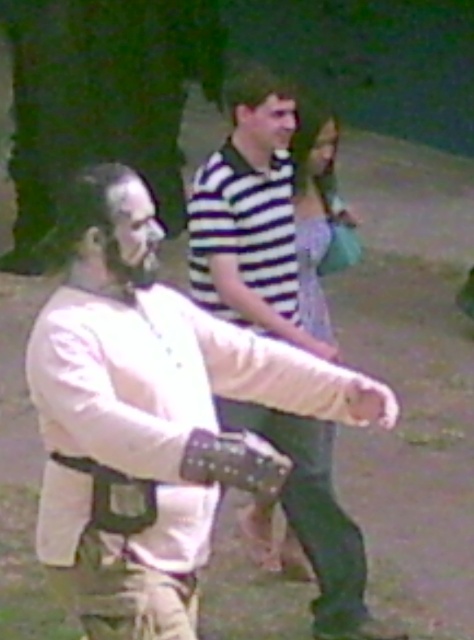
Does point (196, 531) come closer to viewer compared to point (329, 152)?

That is True.

Is white leather armor at center shorter than matte striped shirt at upper center?

Incorrect, white leather armor at center's height does not fall short of matte striped shirt at upper center's.

Does point (155, 308) come farther from viewer compared to point (309, 152)?

No, it is not.

Identify the location of white leather armor at center. (149, 419).

Between white leather armor at center and smooth skin face at center, which one is positioned lower?

white leather armor at center is lower down.

Does white leather armor at center appear on the left side of smooth skin face at center?

Yes, white leather armor at center is to the left of smooth skin face at center.

Between point (247, 400) and point (251, 106), which one is positioned behind?

The point (251, 106) is behind.

Image resolution: width=474 pixels, height=640 pixels. Identify the location of white leather armor at center. [149, 419].

Which is below, striped cotton shirt at center or smooth skin face at center?

Positioned lower is striped cotton shirt at center.

What do you see at coordinates (248, 227) in the screenshot? The height and width of the screenshot is (640, 474). I see `striped cotton shirt at center` at bounding box center [248, 227].

Locate an element on the screen. striped cotton shirt at center is located at coordinates (248, 227).